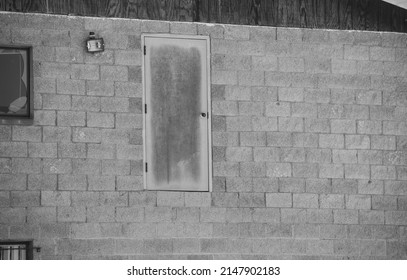
At what (x,y) coordinates should I click in order to perform the action: click on wall. Please return your answer as a coordinate pair (x, y). The height and width of the screenshot is (280, 407). Looking at the image, I should click on (303, 96).